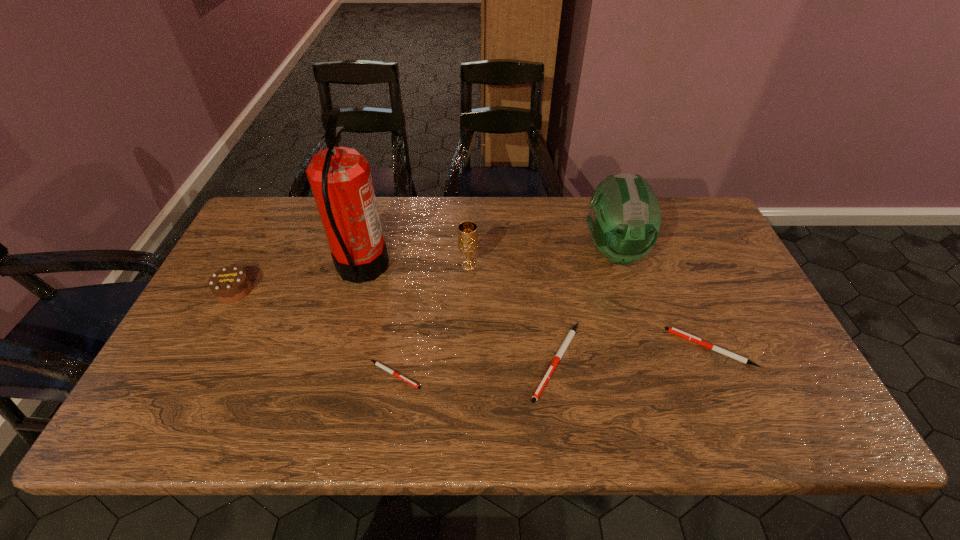
Locate an element on the screen. This screenshot has height=540, width=960. vacant area between the tallest object and the rightmost pen is located at coordinates (536, 308).

Locate an element on the screen. The width and height of the screenshot is (960, 540). object that can be found as the sixth closest to the rightmost pen is located at coordinates (230, 284).

I want to click on object that is the sixth closest one to the fire extinguisher, so click(675, 331).

Locate which pen is the second closest to the fourth tallest object. Please provide its 2D coordinates. Your answer should be formatted as a tuple, i.e. [(x, y)], where the tuple contains the x and y coordinates of a point satisfying the conditions above.

[(566, 342)]

Locate which pen ranks in proximity to the sixth tallest object. Please provide its 2D coordinates. Your answer should be formatted as a tuple, i.e. [(x, y)], where the tuple contains the x and y coordinates of a point satisfying the conditions above.

[(566, 342)]

At what (x,y) coordinates should I click in order to perform the action: click on vacant area that satisfies the following two spatial constraints: 1. on the clicker of the rightmost pen; 2. on the clicker of the second pen from left to right. Please return your answer as a coordinate pair (x, y). The height and width of the screenshot is (540, 960). Looking at the image, I should click on (716, 361).

Identify the location of vacant space that satisfies the following two spatial constraints: 1. on the clicker of the third object from right to left; 2. on the clicker of the shortest object. The width and height of the screenshot is (960, 540). (558, 375).